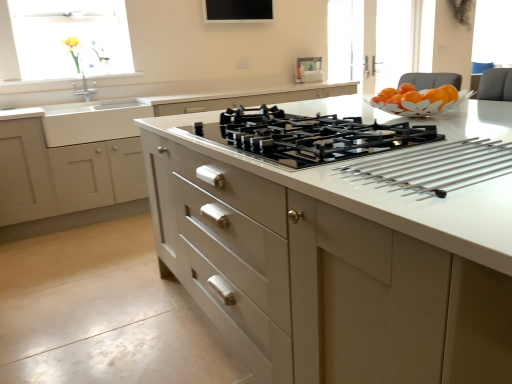
Describe the element at coordinates (100, 148) in the screenshot. I see `matte white drawers at center` at that location.

Identify the location of white glossy sink at left. The width and height of the screenshot is (512, 384). (93, 120).

Where is `white glossy countertop at center`? white glossy countertop at center is located at coordinates (339, 258).

Where is `black glass gas stove at center`? This screenshot has height=384, width=512. black glass gas stove at center is located at coordinates (314, 136).

Between white glossy sink at left and translucent glass window at upper left, which one has less height?

Standing shorter between the two is white glossy sink at left.

Which is in front, point (99, 115) or point (59, 29)?

The point (99, 115) is more forward.

Which is more to the left, white glossy sink at left or translucent glass window at upper left?

Positioned to the left is translucent glass window at upper left.

In the scene shown: Choose the correct answer: Is white glossy sink at left inside translucent glass window at upper left or outside it?

white glossy sink at left is spatially situated outside translucent glass window at upper left.

Considering the points (187, 133) and (74, 199), which point is behind, point (187, 133) or point (74, 199)?

Positioned behind is point (74, 199).

Is white glossy countertop at center spatially inside matte white drawers at center, or outside of it?

white glossy countertop at center cannot be found inside matte white drawers at center.

Considering the relative sizes of matte white drawers at center and yellow matte flower at upper left in the image provided, is matte white drawers at center smaller than yellow matte flower at upper left?

No.

Based on the photo, from the image's perspective, is matte white drawers at center located above or below yellow matte flower at upper left?

matte white drawers at center is situated lower than yellow matte flower at upper left in the image.

Considering the relative positions of black glass tv at upper center and white glossy sink at left in the image provided, is black glass tv at upper center in front of white glossy sink at left?

No, it is behind white glossy sink at left.

Considering the sizes of objects black glass tv at upper center and white glossy sink at left in the image provided, who is shorter, black glass tv at upper center or white glossy sink at left?

With less height is black glass tv at upper center.

From the image's perspective, is black glass tv at upper center on white glossy sink at left?

Yes, from the image's perspective, black glass tv at upper center is above white glossy sink at left.

Based on their positions, is black glass tv at upper center located to the left or right of white glossy sink at left?

Based on their positions, black glass tv at upper center is located to the right of white glossy sink at left.

From the image's perspective, would you say yellow matte flower at upper left is shown under white glossy sink at left?

No, from the image's perspective, yellow matte flower at upper left is not below white glossy sink at left.

Is yellow matte flower at upper left not inside white glossy sink at left?

Yes, yellow matte flower at upper left is outside of white glossy sink at left.

Where is `flower that is behind the white glossy sink at left`? flower that is behind the white glossy sink at left is located at coordinates (73, 50).

Does yellow matte flower at upper left have a greater height compared to white glossy sink at left?

Yes.

Where is `sink in front of the yellow matte flower at upper left`? The width and height of the screenshot is (512, 384). sink in front of the yellow matte flower at upper left is located at coordinates (93, 120).

Is white glossy sink at left oriented away from yellow matte flower at upper left?

No, yellow matte flower at upper left is not at the back of white glossy sink at left.

From a real-world perspective, is white glossy sink at left physically above yellow matte flower at upper left?

Incorrect, from a real-world perspective, white glossy sink at left is lower than yellow matte flower at upper left.

Considering the points (68, 105) and (70, 49), which point is behind, point (68, 105) or point (70, 49)?

Positioned behind is point (70, 49).

Is point (505, 151) positioned after point (237, 2)?

No, it is not.

From the image's perspective, is white glossy countertop at center positioned above or below black glass tv at upper center?

white glossy countertop at center is situated lower than black glass tv at upper center in the image.

Considering the sizes of objects white glossy countertop at center and black glass tv at upper center in the image provided, who is shorter, white glossy countertop at center or black glass tv at upper center?

With less height is black glass tv at upper center.

Identify the location of window behind the white glossy sink at left. (69, 38).

You are a GUI agent. You are given a task and a screenshot of the screen. Output one action in this format:
    pyautogui.click(x=<x>, y=<y>)
    Task: Click on the cabinetry above the white glossy countertop at center (from the image's perspective)
    Image resolution: width=512 pixels, height=384 pixels.
    Given the screenshot: What is the action you would take?
    pyautogui.click(x=100, y=148)

Based on their spatial positions, is white glossy sink at left or white glossy countertop at center further from translucent glass window at upper left?

white glossy countertop at center is positioned further to the anchor translucent glass window at upper left.

Estimate the real-world distances between objects in this image. Which object is closer to matte white drawers at center, black glass tv at upper center or translucent glass window at upper left?

Among the two, translucent glass window at upper left is located nearer to matte white drawers at center.

Which object lies nearer to the anchor point white glossy countertop at center, yellow matte flower at upper left or matte white drawers at center?

matte white drawers at center is closer to white glossy countertop at center.

Based on their spatial positions, is white glossy countertop at center or white glossy sink at left further from yellow matte flower at upper left?

Among the two, white glossy countertop at center is located further to yellow matte flower at upper left.

Looking at the image, which one is located closer to black glass gas stove at center, translucent glass window at upper left or matte white drawers at center?

The object closer to black glass gas stove at center is matte white drawers at center.

Estimate the real-world distances between objects in this image. Which object is closer to white glossy countertop at center, black glass gas stove at center or white glossy sink at left?

black glass gas stove at center lies closer to white glossy countertop at center than the other object.

Estimate the real-world distances between objects in this image. Which object is further from black glass gas stove at center, translucent glass window at upper left or white glossy sink at left?

Based on the image, translucent glass window at upper left appears to be further to black glass gas stove at center.

Based on their spatial positions, is black glass gas stove at center or translucent glass window at upper left further from matte white drawers at center?

The object further to matte white drawers at center is black glass gas stove at center.

At what (x,y) coordinates should I click in order to perform the action: click on cabinetry between white glossy countertop at center and black glass tv at upper center in the front-back direction. Please return your answer as a coordinate pair (x, y). Looking at the image, I should click on (100, 148).

Where is `cabinetry between yellow matte flower at upper left and black glass tv at upper center from left to right`? cabinetry between yellow matte flower at upper left and black glass tv at upper center from left to right is located at coordinates (100, 148).

I want to click on gas stove located between white glossy countertop at center and yellow matte flower at upper left in the depth direction, so click(314, 136).

Where is `sink between black glass gas stove at center and yellow matte flower at upper left from front to back`? sink between black glass gas stove at center and yellow matte flower at upper left from front to back is located at coordinates (93, 120).